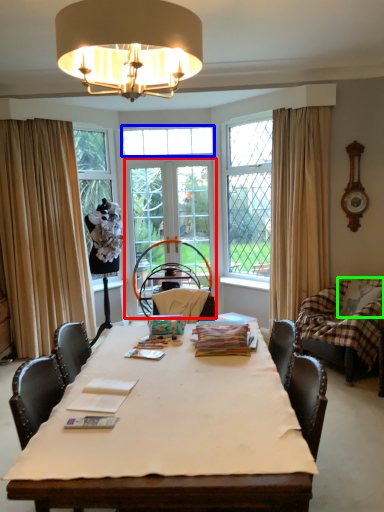
Question: Which object is positioned farthest from screen door (highlighted by a red box)? Select from window (highlighted by a blue box) and pillow (highlighted by a green box).

Choices:
 (A) window
 (B) pillow

Answer: (B)